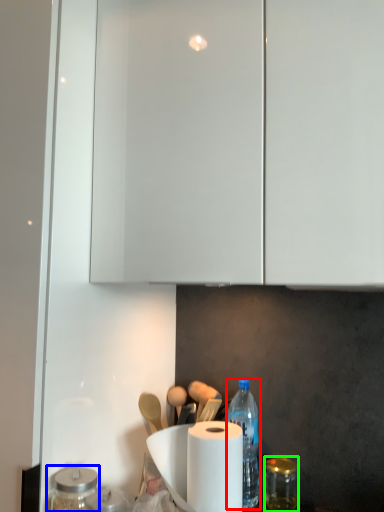
Question: Which is nearer to the bottle (highlighted by a red box)? glass jar (highlighted by a blue box) or glass jar (highlighted by a green box).

Choices:
 (A) glass jar
 (B) glass jar

Answer: (B)